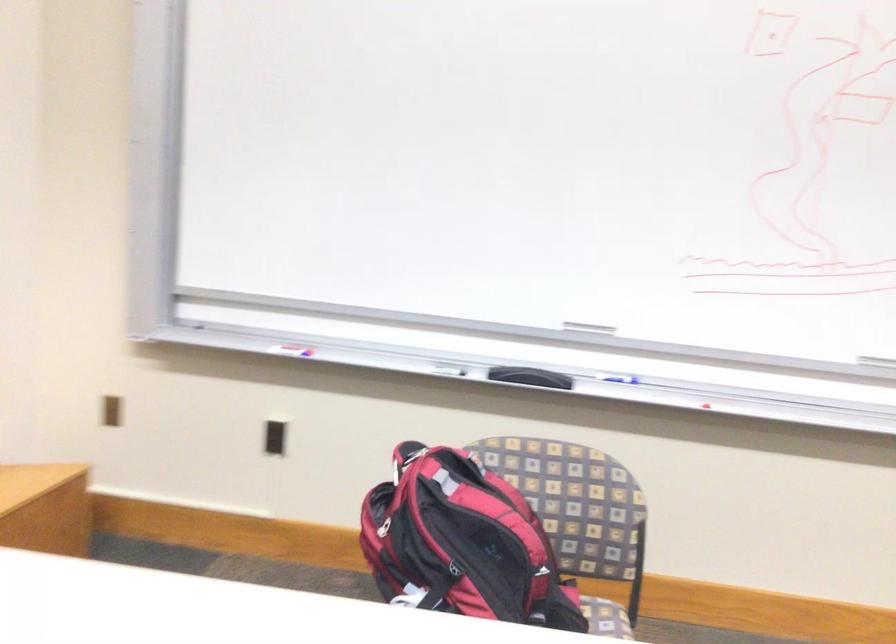
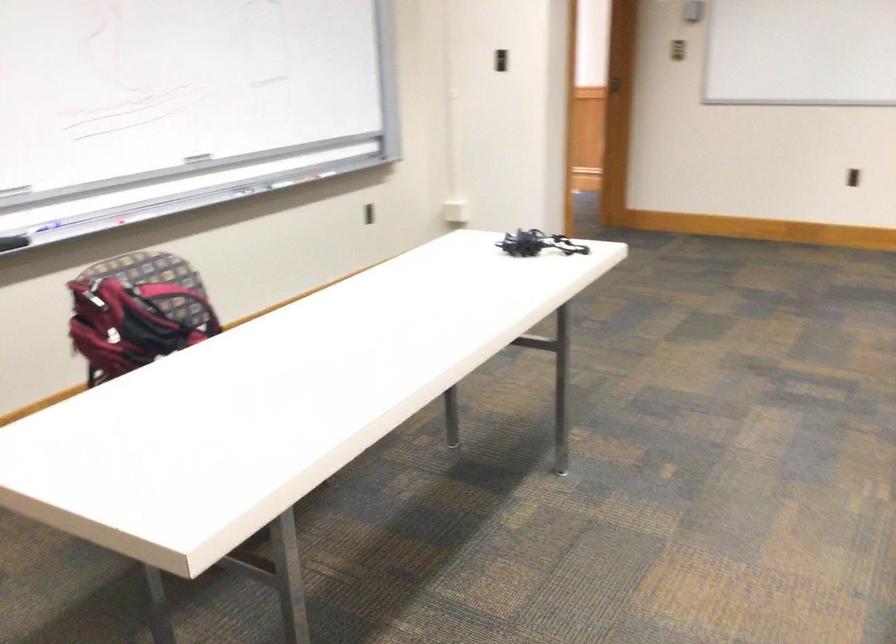
Question: I am providing you with two images of the same scene from different viewpoints. After the viewpoint changes to image2, which objects are now occluded?

Choices:
 (A) blue whiteboard marker
 (B) polka-dot container
 (C) black whiteboard eraser
 (D) chair sitting surface

Answer: (D)